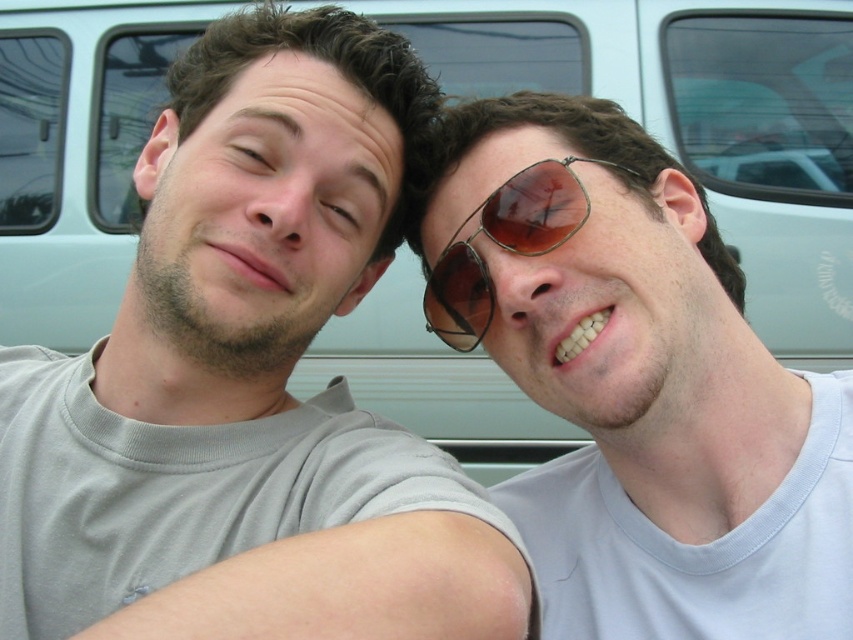
Question: Which point is farther from the camera taking this photo?

Choices:
 (A) (566, 164)
 (B) (254, 166)

Answer: (A)

Question: Observing the image, what is the correct spatial positioning of gray matte t-shirt at left in reference to matte skin at center?

Choices:
 (A) below
 (B) above

Answer: (A)

Question: Can you confirm if gray matte t-shirt at left is thinner than brown matte eye at center?

Choices:
 (A) no
 (B) yes

Answer: (A)

Question: Which point appears farthest from the camera in this image?

Choices:
 (A) (506, 234)
 (B) (268, 154)
 (C) (323, 196)
 (D) (770, 385)

Answer: (A)

Question: Which point is farther to the camera?

Choices:
 (A) gray matte t-shirt at left
 (B) sunglasses at right
 (C) metal aviator sunglasses at center

Answer: (C)

Question: Where is gray matte t-shirt at left located in relation to metal aviator sunglasses at center in the image?

Choices:
 (A) above
 (B) below

Answer: (B)